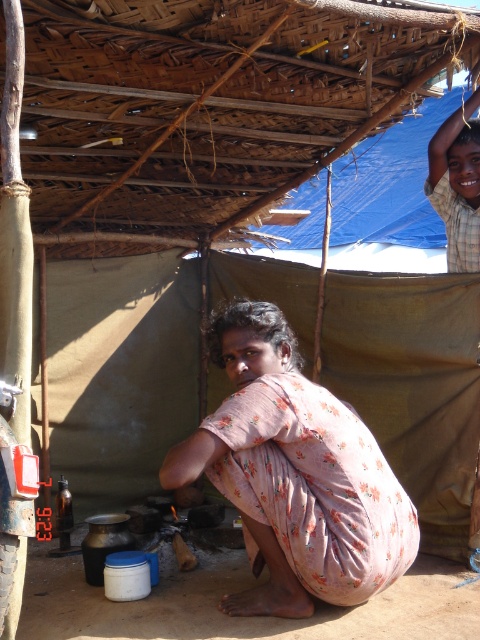
Question: Does floral cotton dress at center lie behind light brown wooden headband at upper right?

Choices:
 (A) yes
 (B) no

Answer: (B)

Question: Where is bamboo mat at upper center located in relation to light brown wooden headband at upper right in the image?

Choices:
 (A) below
 (B) above

Answer: (B)

Question: Is bamboo mat at upper center above floral cotton dress at center?

Choices:
 (A) no
 (B) yes

Answer: (B)

Question: Which point appears closest to the camera in this image?

Choices:
 (A) [x=175, y=173]
 (B) [x=443, y=145]
 (C) [x=280, y=544]

Answer: (C)

Question: Among these points, which one is nearest to the camera?

Choices:
 (A) (468, 180)
 (B) (382, 481)

Answer: (B)

Question: Which of the following is the farthest from the observer?

Choices:
 (A) (456, 228)
 (B) (257, 136)
 (C) (207, 460)

Answer: (A)